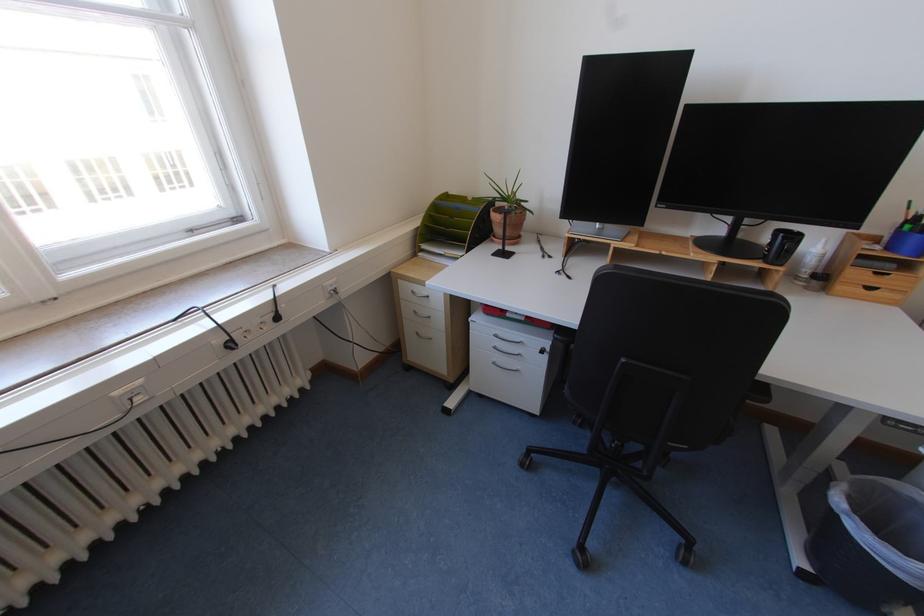
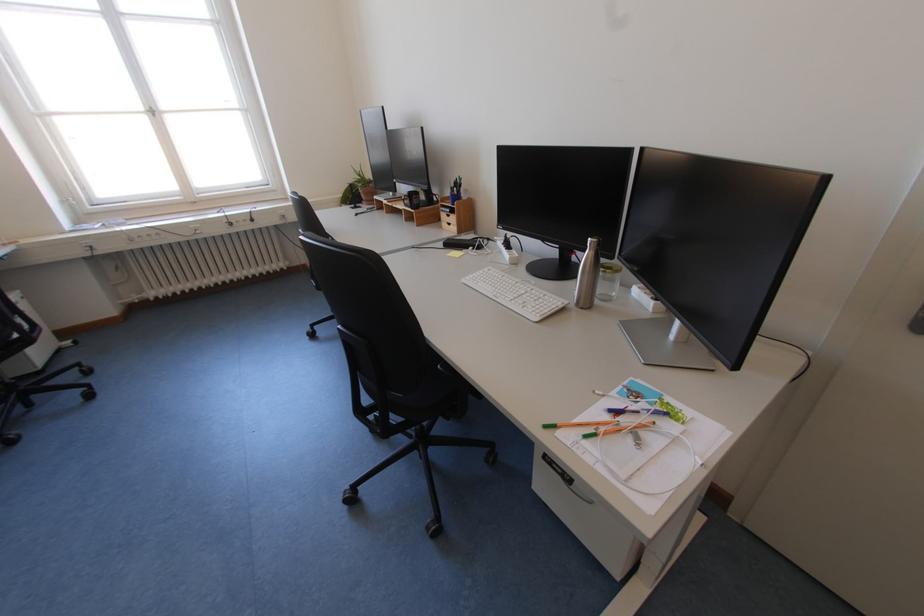
Question: Which direction would the cameraman need to move to produce the second image? Reply with the corresponding letter.

Choices:
 (A) Left
 (B) Right
 (C) Forward
 (D) Backward

Answer: (B)